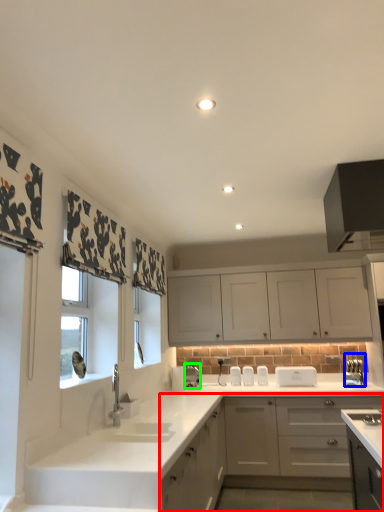
Question: Considering the real-world distances, which object is farthest from cabinetry (highlighted by a red box)? appliance (highlighted by a blue box) or appliance (highlighted by a green box)?

Choices:
 (A) appliance
 (B) appliance

Answer: (B)